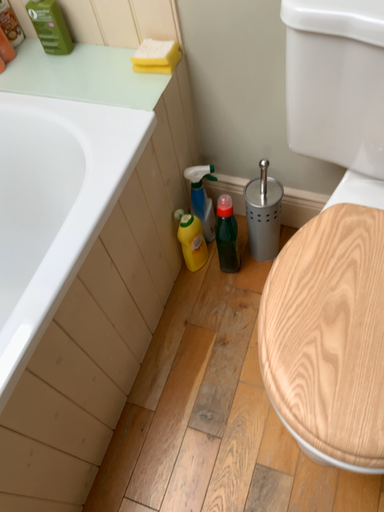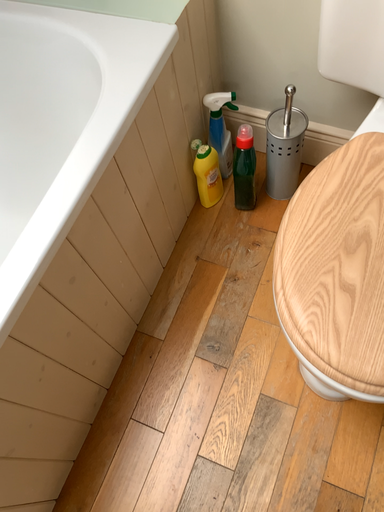
Question: Which way did the camera rotate in the video?

Choices:
 (A) rotated upward
 (B) rotated downward

Answer: (B)